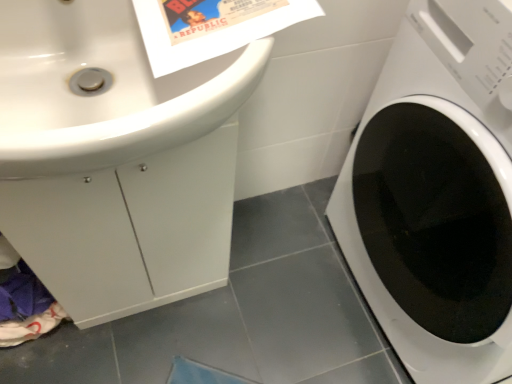
Question: In terms of height, does white glossy washing machine at right look taller or shorter compared to white glossy sink at upper left?

Choices:
 (A) short
 (B) tall

Answer: (B)

Question: Is white glossy washing machine at right inside the boundaries of white glossy sink at upper left, or outside?

Choices:
 (A) inside
 (B) outside

Answer: (B)

Question: From the image's perspective, relative to white glossy sink at upper left, is white glossy washing machine at right above or below?

Choices:
 (A) below
 (B) above

Answer: (A)

Question: Is white glossy sink at upper left in front of or behind white glossy washing machine at right in the image?

Choices:
 (A) front
 (B) behind

Answer: (A)

Question: From a real-world perspective, is white glossy sink at upper left above or below white glossy washing machine at right?

Choices:
 (A) below
 (B) above

Answer: (B)

Question: Based on their sizes in the image, would you say white glossy sink at upper left is bigger or smaller than white glossy washing machine at right?

Choices:
 (A) big
 (B) small

Answer: (B)

Question: Considering the positions of white glossy sink at upper left and white glossy washing machine at right in the image, is white glossy sink at upper left wider or thinner than white glossy washing machine at right?

Choices:
 (A) wide
 (B) thin

Answer: (B)